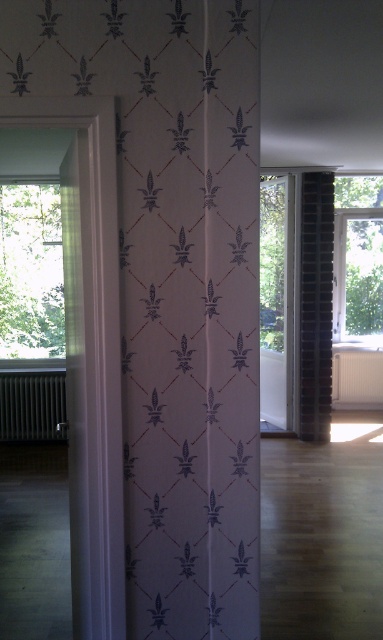
You are an interior designer planning to place a 1.2 meter wide sofa between the dark brick pillar at right and the black metallic radiator at left. Based on the space provided, will the sofa fit comfortably without touching either object?

The dark brick pillar at right is narrower than the black metallic radiator at left. However, the exact distance between them isn not specified. To determine if the sofa fits, you need to ensure the space between the two objects is at least 1.2 meters plus some clearance. Without specific spacing data, we can only confirm the pillar is narrower, but the total width isn known.

You are an interior designer planning to install a new decorative element between the white paper curtain at center and the transparent glass window at right. The element requires a minimum of 5 meters of space. Based on the scene, will there be enough space for it?

The distance between the white paper curtain at center and the transparent glass window at right is 4.81 meters, which is less than the required 5 meters. Therefore, there is insufficient space for the decorative element.

You are an interior designer assessing the space between the dark brick pillar at right and the black metallic radiator at left. Which object is taller?

The dark brick pillar at right is taller than the black metallic radiator at left.